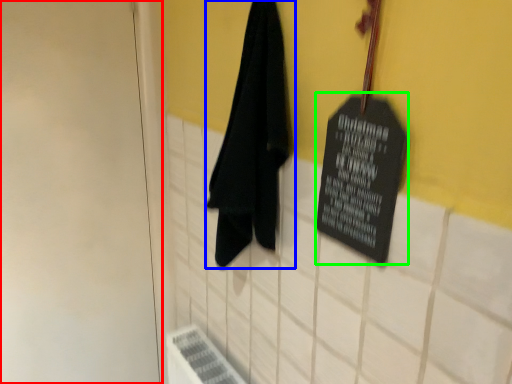
Question: Considering the real-world distances, which object is farthest from door (highlighted by a red box)? towel (highlighted by a blue box) or bulletin board (highlighted by a green box)?

Choices:
 (A) towel
 (B) bulletin board

Answer: (B)